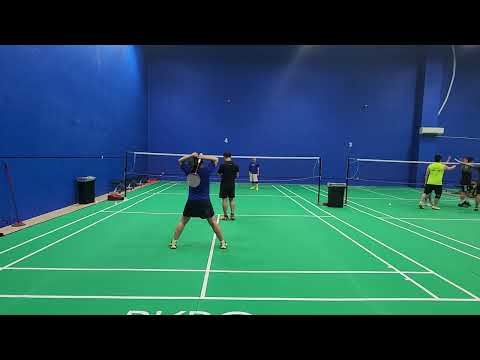
The image size is (480, 360). Find the location of `walls`. walls is located at coordinates point(86,114), point(307,129).